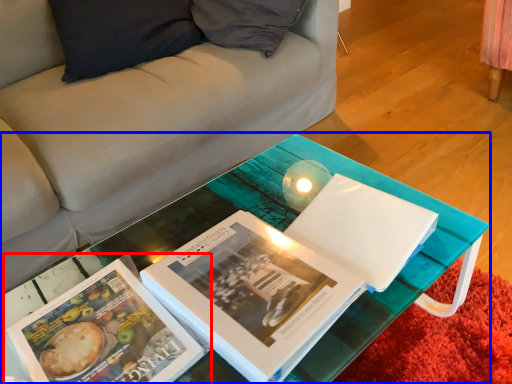
Question: Which of the following is the farthest to the observer, book (highlighted by a red box) or table (highlighted by a blue box)?

Choices:
 (A) book
 (B) table

Answer: (A)